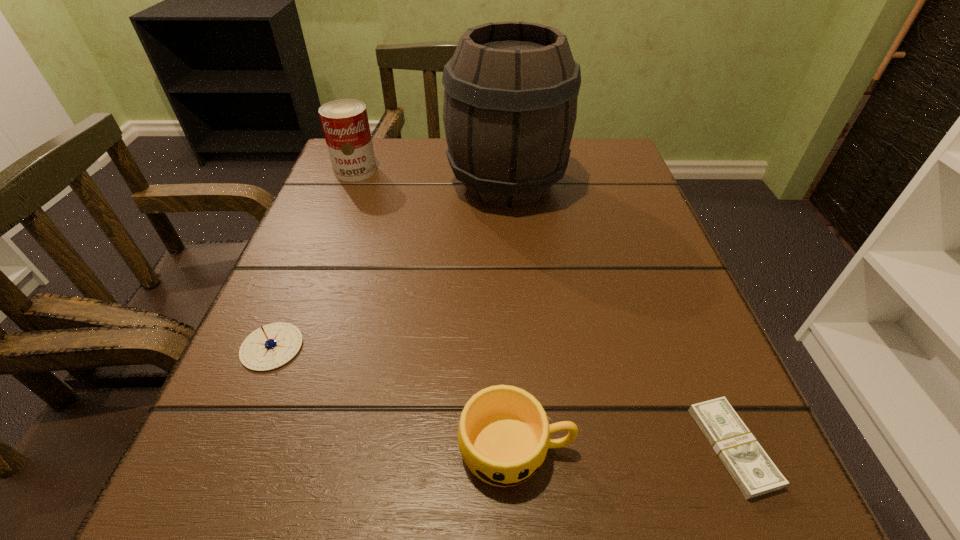
Identify the location of object that is at the far left corner. (345, 124).

The image size is (960, 540). What are the coordinates of `object that is at the far right corner` in the screenshot? It's located at [510, 101].

The height and width of the screenshot is (540, 960). I want to click on object that is at the near right corner, so click(749, 465).

You are a GUI agent. You are given a task and a screenshot of the screen. Output one action in this format:
    pyautogui.click(x=<x>, y=<y>)
    Task: Click on the vacant region at the far edge of the desktop
    Image resolution: width=960 pixels, height=540 pixels.
    Given the screenshot: What is the action you would take?
    pyautogui.click(x=439, y=141)

Identify the location of free space at the left edge of the desktop. The image size is (960, 540). (313, 241).

Locate an element on the screen. This screenshot has width=960, height=540. vacant space at the right edge is located at coordinates (626, 319).

Locate an element on the screen. The height and width of the screenshot is (540, 960). free area in between the second shortest object and the second tallest object is located at coordinates (314, 259).

In order to click on vacant point located between the tallest object and the shortest object in this screenshot , I will do `click(619, 315)`.

The width and height of the screenshot is (960, 540). In order to click on free space between the second tallest object and the second shortest object in this screenshot , I will do `click(314, 259)`.

I want to click on vacant space that is in between the tallest object and the shortest object, so click(x=619, y=315).